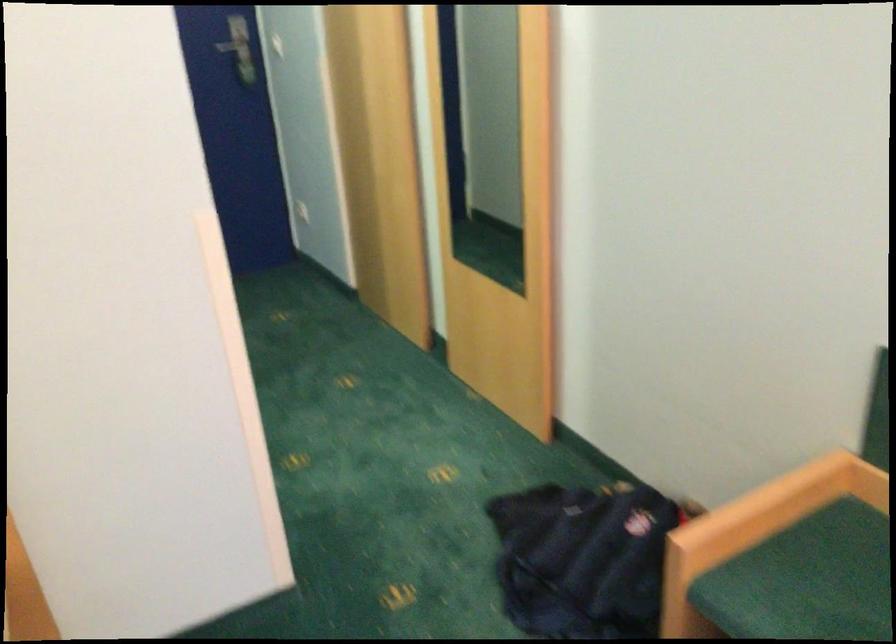
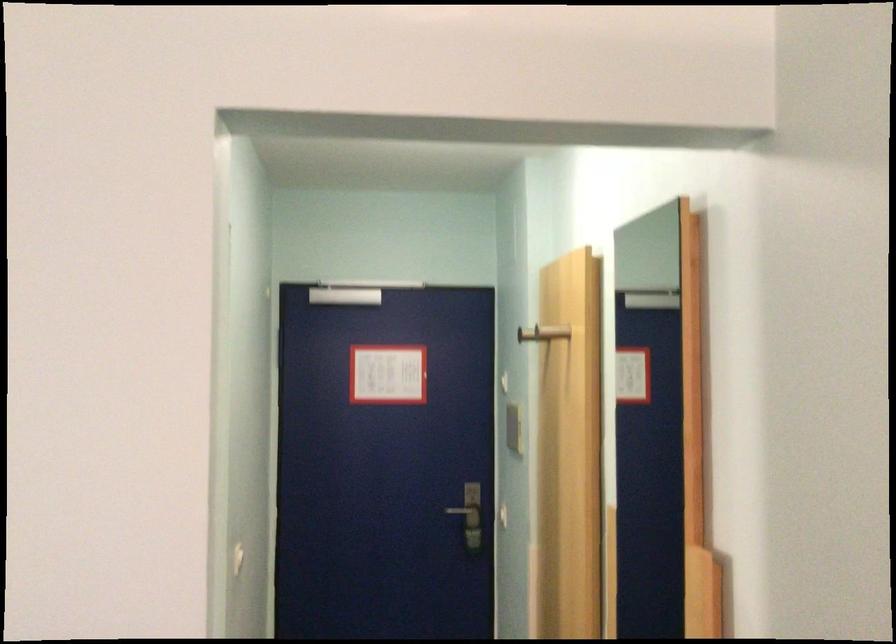
The first image is from the beginning of the video and the second image is from the end. How did the camera likely rotate when shooting the video?

The camera rotated toward left-up.